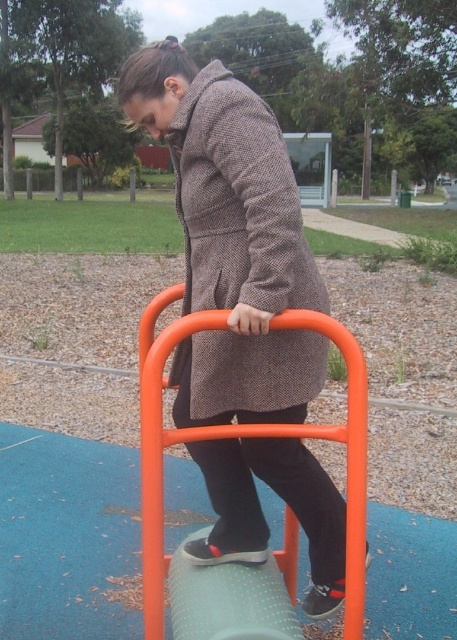
You are a fashion designer observing two coats at a park event. The person is wearing the matte brown coat at center and the herringbone wool coat at center. Which coat is taller on the person?

The matte brown coat at center is much taller than the herringbone wool coat at center.

The person in the image is wearing two coats, a matte brown coat at center and a herringbone wool coat at center. Which coat is wider?

The matte brown coat at center might be wider than the herringbone wool coat at center.